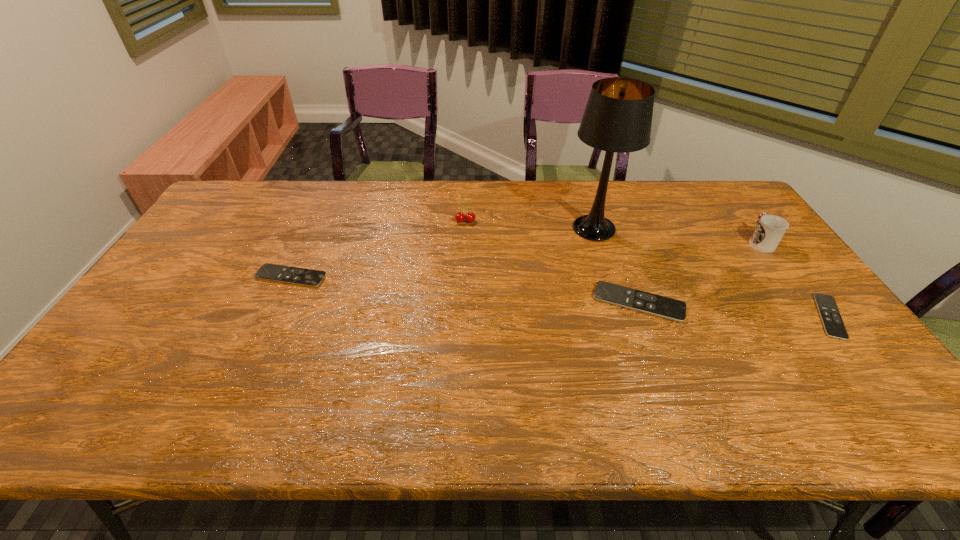
At what (x,y) coordinates should I click in order to perform the action: click on free space located on the back of the third shortest object. Please return your answer as a coordinate pair (x, y). Image resolution: width=960 pixels, height=540 pixels. Looking at the image, I should click on (608, 217).

This screenshot has width=960, height=540. Find the location of `blank space located on the back of the rightmost remote control`. blank space located on the back of the rightmost remote control is located at coordinates (792, 268).

Image resolution: width=960 pixels, height=540 pixels. Find the location of `free space located 0.230m on the handle side of the cup`. free space located 0.230m on the handle side of the cup is located at coordinates (724, 193).

Locate an element on the screen. Image resolution: width=960 pixels, height=540 pixels. vacant area situated 0.320m on the handle side of the cup is located at coordinates (714, 180).

Image resolution: width=960 pixels, height=540 pixels. I want to click on vacant space situated 0.100m on the handle side of the cup, so click(739, 213).

At what (x,y) coordinates should I click in order to perform the action: click on vacant space located 0.340m on the right of the table lamp. Please return your answer as a coordinate pair (x, y). Looking at the image, I should click on (728, 228).

Find the location of a particular element. The height and width of the screenshot is (540, 960). vacant space situated 0.300m with the stems of the cherry pointing upwards is located at coordinates (463, 287).

The image size is (960, 540). Find the location of `table lamp that is at the far edge`. table lamp that is at the far edge is located at coordinates (618, 116).

Where is `cherry that is at the far edge`? cherry that is at the far edge is located at coordinates (459, 217).

Where is `remote control that is at the right edge`? remote control that is at the right edge is located at coordinates (834, 327).